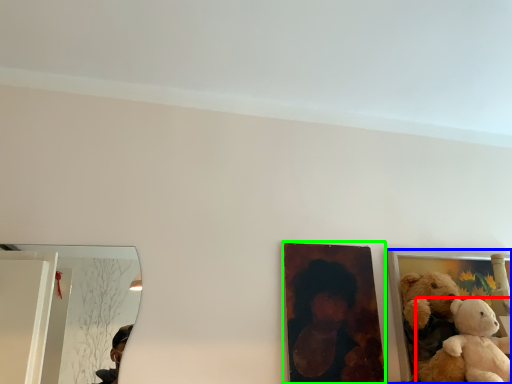
Question: Which is nearer to the teddy bear (highlighted by a red box)? picture frame (highlighted by a blue box) or picture frame (highlighted by a green box).

Choices:
 (A) picture frame
 (B) picture frame

Answer: (A)